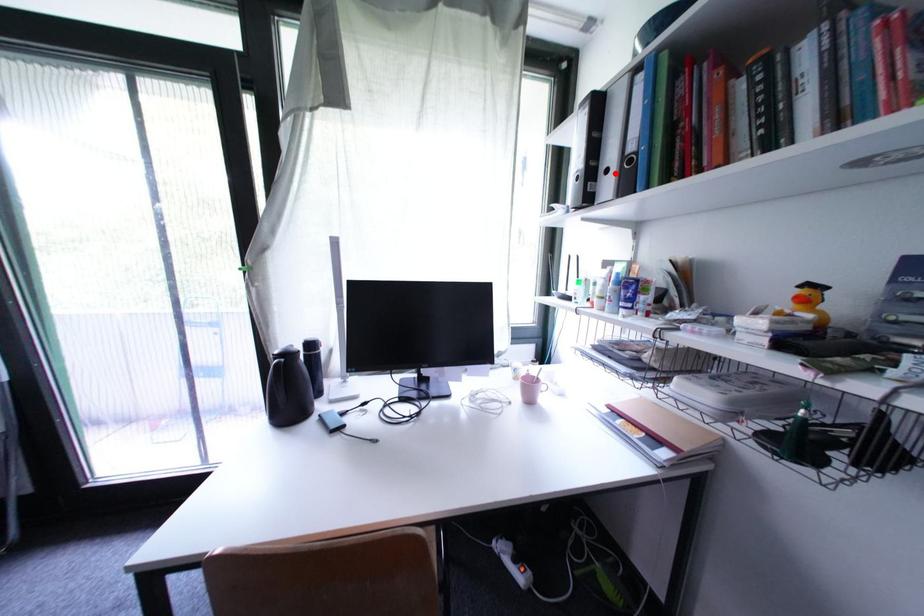
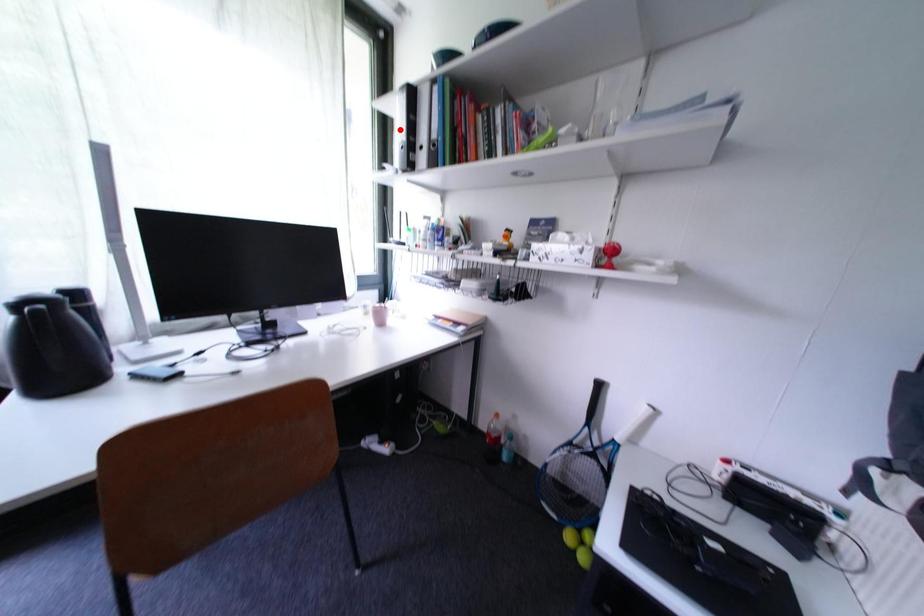
I am providing you with two images of the same scene from different viewpoints. A red point is marked on the first image and another point is marked on the second image. Does the point marked in image1 correspond to the same location as the one in image2?

No